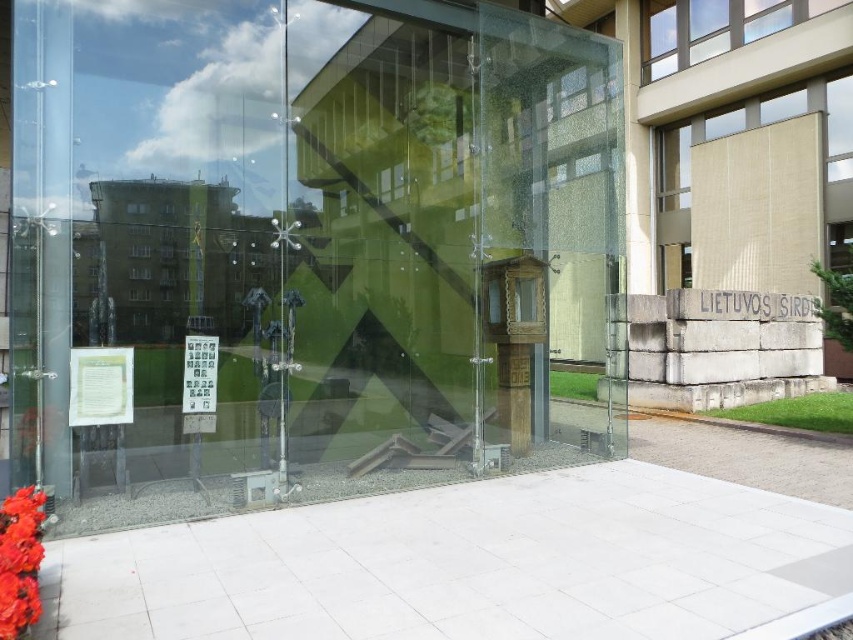
Can you confirm if transparent glass box at center is smaller than vivid red petals at lower left?

Correct, transparent glass box at center occupies less space than vivid red petals at lower left.

Can you confirm if transparent glass box at center is positioned below vivid red petals at lower left?

Incorrect, transparent glass box at center is not positioned below vivid red petals at lower left.

You are a GUI agent. You are given a task and a screenshot of the screen. Output one action in this format:
    pyautogui.click(x=<x>, y=<y>)
    Task: Click on the transparent glass box at center
    Image resolution: width=853 pixels, height=640 pixels.
    Given the screenshot: What is the action you would take?
    pyautogui.click(x=306, y=250)

I want to click on transparent glass box at center, so click(x=306, y=250).